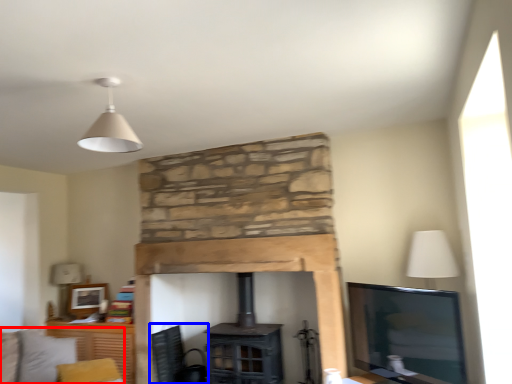
Question: Which object appears farthest to the camera in this image, couch (highlighted by a red box) or swivel chair (highlighted by a blue box)?

Choices:
 (A) couch
 (B) swivel chair

Answer: (B)